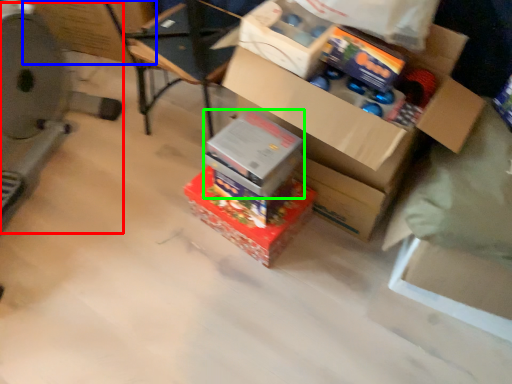
Question: Which object is positioned closest to wide (highlighted by a red box)? Select from cardboard box (highlighted by a blue box) and box (highlighted by a green box).

Choices:
 (A) cardboard box
 (B) box

Answer: (A)